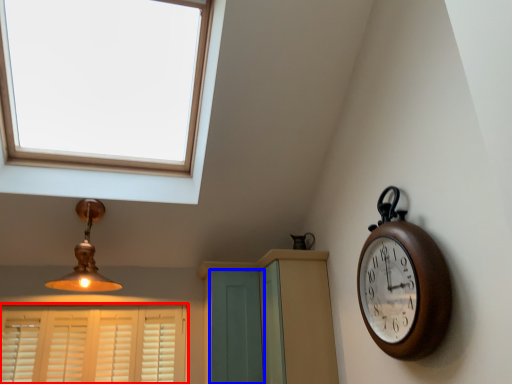
Question: Which object appears closest to the camera in this image, window (highlighted by a red box) or screen door (highlighted by a blue box)?

Choices:
 (A) window
 (B) screen door

Answer: (B)